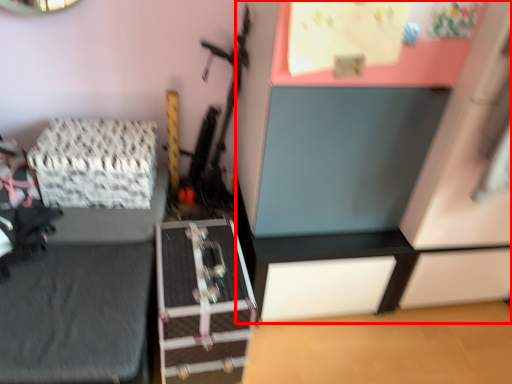
Question: In this image, where is dresser (annotated by the red box) located relative to package?

Choices:
 (A) right
 (B) left

Answer: (A)